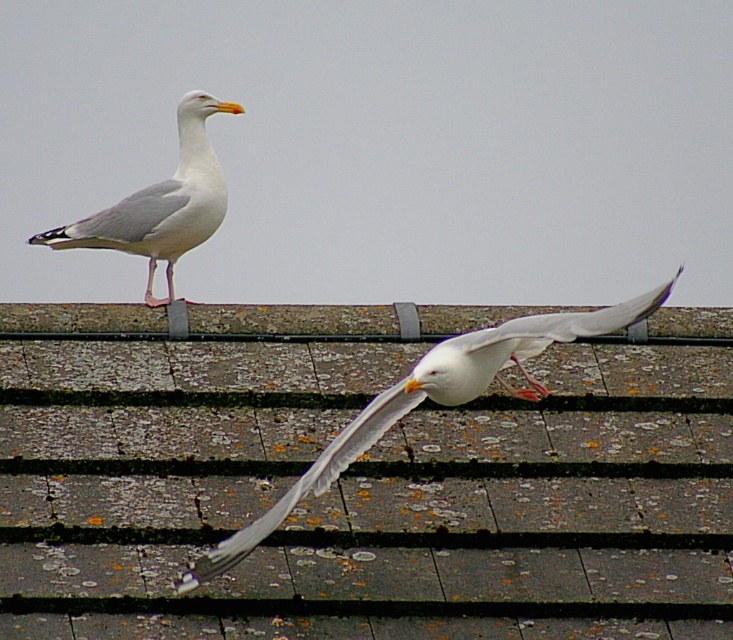
Is white feathered bird at center further to the viewer compared to white feathered seagull at upper left?

No, white feathered bird at center is closer to the viewer.

Is point (449, 396) less distant than point (218, 221)?

That is True.

Is point (265, 512) behind point (185, 144)?

That is False.

The image size is (733, 640). I want to click on white feathered bird at center, so click(x=432, y=401).